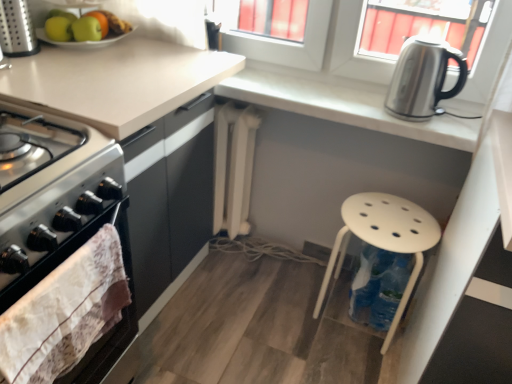
Identify the location of vacant area that is in front of green matte apple at upper left. (96, 50).